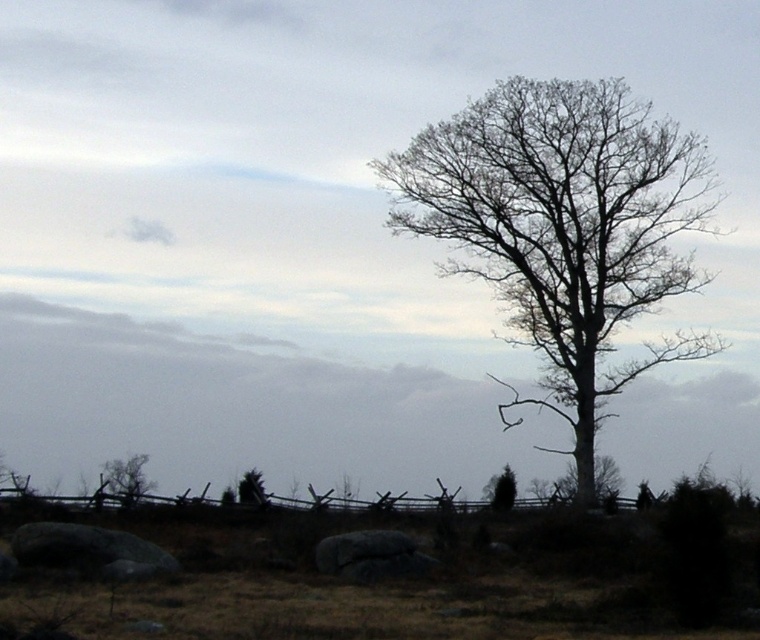
Question: Can you confirm if gray rough stone at lower left is positioned above brown textured tree at lower left?

Choices:
 (A) no
 (B) yes

Answer: (B)

Question: Can you confirm if bare wood tree at center is thinner than gray rough stone at lower left?

Choices:
 (A) no
 (B) yes

Answer: (A)

Question: Among these points, which one is farthest from the camera?

Choices:
 (A) (597, 116)
 (B) (105, 480)

Answer: (A)

Question: From the image, what is the correct spatial relationship of green matte tree at lower center in relation to green matte tree at lower left?

Choices:
 (A) right
 (B) left

Answer: (A)

Question: Which of these objects is positioned closest to the green matte tree at lower center?

Choices:
 (A) green matte tree at lower left
 (B) bare wood tree at center
 (C) gray rough stone at lower left
 (D) brown textured tree at lower left

Answer: (B)

Question: Based on their relative distances, which object is farther from the brown textured tree at lower left?

Choices:
 (A) green matte tree at lower center
 (B) gray rough stone at lower left

Answer: (B)